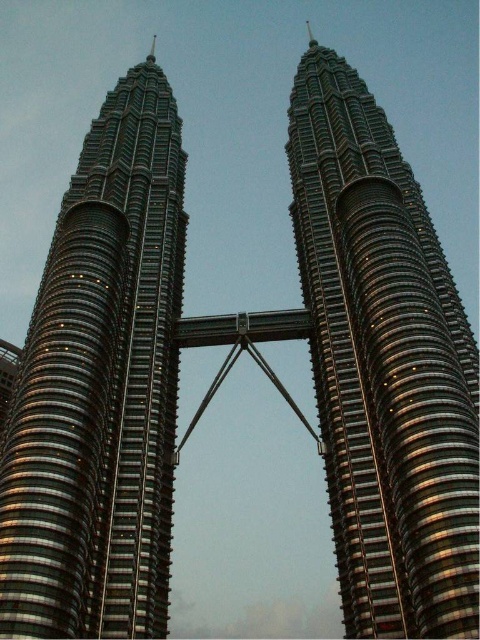
Which of these two, shiny metallic skyscraper at left or shiny metallic tower at center, stands taller?

With more height is shiny metallic tower at center.

Looking at this image, is shiny metallic skyscraper at left below shiny metallic tower at center?

Yes.

At what (x,y) coordinates should I click in order to perform the action: click on shiny metallic skyscraper at left. Please return your answer as a coordinate pair (x, y). Looking at the image, I should click on (100, 387).

Locate an element on the screen. Image resolution: width=480 pixels, height=640 pixels. shiny metallic skyscraper at left is located at coordinates (100, 387).